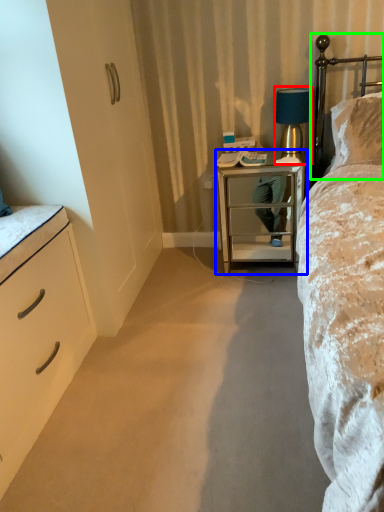
Question: Which object is the closest to the table lamp (highlighted by a red box)? Choose among these: nightstand (highlighted by a blue box) or headboard (highlighted by a green box).

Choices:
 (A) nightstand
 (B) headboard

Answer: (B)